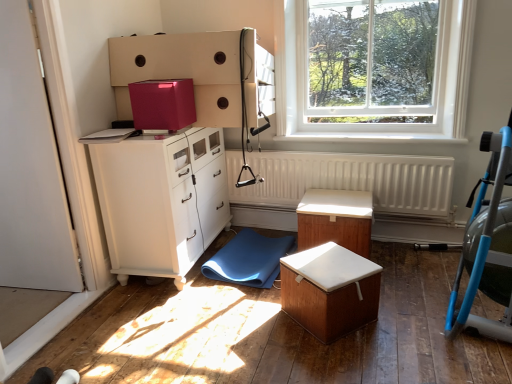
Image resolution: width=512 pixels, height=384 pixels. Find the location of `free point above white matte radiator at center (from a real-world perspective)`. free point above white matte radiator at center (from a real-world perspective) is located at coordinates (355, 152).